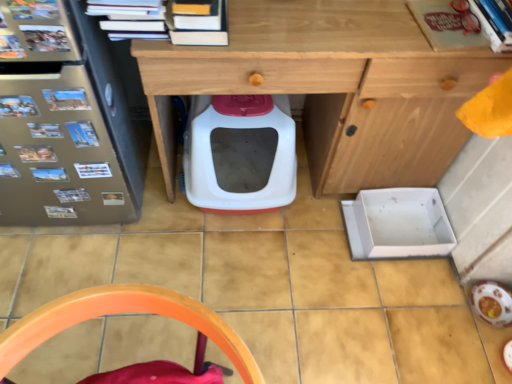
The width and height of the screenshot is (512, 384). Find the location of `orange plastic chair at lower center`. orange plastic chair at lower center is located at coordinates (131, 311).

Measure the distance between point (121, 34) and camera.

The distance of point (121, 34) from camera is 38.19 inches.

What do you see at coordinates (495, 22) in the screenshot?
I see `hardcover book at upper right, the 1th book viewed from the right` at bounding box center [495, 22].

What is the approximate width of matte red book at upper right, which appears as the 2th book when viewed from the left?

matte red book at upper right, which appears as the 2th book when viewed from the left, is 8.41 inches in width.

Where is `orange plastic chair at lower center`? orange plastic chair at lower center is located at coordinates (131, 311).

Is hardcover books at upper center, the 1th book positioned from the left, aimed at hardcover book at upper right, the 1th book viewed from the right?

No.

Between hardcover books at upper center, the third book when ordered from right to left, and hardcover book at upper right, the 1th book viewed from the right, which one has smaller size?

hardcover book at upper right, the 1th book viewed from the right.

Is hardcover books at upper center, the 1th book positioned from the left, not close to hardcover book at upper right, the 1th book viewed from the right?

That's not correct — hardcover books at upper center, the 1th book positioned from the left, is a little close to hardcover book at upper right, the 1th book viewed from the right.

Is hardcover books at upper center, the third book when ordered from right to left, facing away from metallic silver fridge at left?

No, metallic silver fridge at left is not at the back of hardcover books at upper center, the third book when ordered from right to left.

From the image's perspective, is hardcover books at upper center, the 1th book positioned from the left, located above or below metallic silver fridge at left?

Based on their image positions, hardcover books at upper center, the 1th book positioned from the left, is located above metallic silver fridge at left.

In the scene shown: Is hardcover books at upper center, the 1th book positioned from the left, outside of metallic silver fridge at left?

Yes, hardcover books at upper center, the 1th book positioned from the left, is not within metallic silver fridge at left.

Is hardcover books at upper center, the third book when ordered from right to left, smaller than metallic silver fridge at left?

Correct, hardcover books at upper center, the third book when ordered from right to left, occupies less space than metallic silver fridge at left.

From a real-world perspective, is hardcover book at upper right, which is the 3th book from left to right, physically below orange plastic chair at lower center?

No, from a real-world perspective, hardcover book at upper right, which is the 3th book from left to right, is not below orange plastic chair at lower center.

Based on their positions, is hardcover book at upper right, which is the 3th book from left to right, located to the left or right of orange plastic chair at lower center?

Based on their positions, hardcover book at upper right, which is the 3th book from left to right, is located to the right of orange plastic chair at lower center.

What's the angular difference between hardcover book at upper right, which is the 3th book from left to right, and orange plastic chair at lower center's facing directions?

They differ by 15.2 degrees in their facing directions.

Does hardcover book at upper right, the 1th book viewed from the right, touch orange plastic chair at lower center?

No, hardcover book at upper right, the 1th book viewed from the right, is not making contact with orange plastic chair at lower center.

Between hardcover book at upper right, the 1th book viewed from the right, and metallic silver fridge at left, which one appears on the left side from the viewer's perspective?

metallic silver fridge at left.

How distant is hardcover book at upper right, which is the 3th book from left to right, from metallic silver fridge at left?

hardcover book at upper right, which is the 3th book from left to right, is 3.74 feet away from metallic silver fridge at left.

Looking at this image, is hardcover book at upper right, which is the 3th book from left to right, bigger than metallic silver fridge at left?

No, hardcover book at upper right, which is the 3th book from left to right, is not bigger than metallic silver fridge at left.

Is hardcover book at upper right, which is the 3th book from left to right, shorter than metallic silver fridge at left?

Yes, hardcover book at upper right, which is the 3th book from left to right, is shorter than metallic silver fridge at left.

Identify the location of desk located on the right of orange plastic chair at lower center. This screenshot has width=512, height=384. (334, 86).

Considering the sizes of objects wooden desk at center and orange plastic chair at lower center in the image provided, who is bigger, wooden desk at center or orange plastic chair at lower center?

Bigger between the two is wooden desk at center.

Is point (362, 144) less distant than point (3, 345)?

No, it is not.

Does wooden desk at center have a greater width compared to orange plastic chair at lower center?

Indeed, wooden desk at center has a greater width compared to orange plastic chair at lower center.

Consider the image. How much distance is there between hardcover books at upper center, the third book when ordered from right to left, and orange plastic chair at lower center?

The distance of hardcover books at upper center, the third book when ordered from right to left, from orange plastic chair at lower center is 24.94 inches.

Is hardcover books at upper center, the 1th book positioned from the left, positioned with its back to orange plastic chair at lower center?

No, hardcover books at upper center, the 1th book positioned from the left,'s orientation is not away from orange plastic chair at lower center.

Which is in front, point (177, 3) or point (9, 357)?

The point (9, 357) is closer.

Can you confirm if hardcover books at upper center, the 1th book positioned from the left, is shorter than orange plastic chair at lower center?

Indeed, hardcover books at upper center, the 1th book positioned from the left, has a lesser height compared to orange plastic chair at lower center.

Could you tell me if metallic silver fridge at left is facing matte red book at upper right, which appears as the 2th book when viewed from the left?

No.

Which is in front, metallic silver fridge at left or matte red book at upper right, which appears as the 2th book when viewed from the left?

metallic silver fridge at left is in front.

Can you confirm if metallic silver fridge at left is taller than matte red book at upper right, which appears as the 2th book when viewed from the left?

Correct, metallic silver fridge at left is much taller as matte red book at upper right, which appears as the 2th book when viewed from the left.

Considering the positions of objects metallic silver fridge at left and matte red book at upper right, which is the 2th book from right to left, in the image provided, who is more to the left, metallic silver fridge at left or matte red book at upper right, which is the 2th book from right to left,?

metallic silver fridge at left is more to the left.

In the image, there is a hardcover book at upper right, which is the 3th book from left to right. At what (x,y) coordinates should I click in order to perform the action: click on book above it (from the image's perspective). Please return your answer as a coordinate pair (x, y). Looking at the image, I should click on (163, 20).

I want to click on fridge below the hardcover books at upper center, the third book when ordered from right to left (from the image's perspective), so click(68, 119).

Considering their positions, is wooden desk at center positioned closer to orange plastic chair at lower center than hardcover books at upper center, the 1th book positioned from the left?

hardcover books at upper center, the 1th book positioned from the left, lies closer to orange plastic chair at lower center than the other object.

Looking at the image, which one is located closer to orange plastic chair at lower center, wooden desk at center or white plastic litter box at center?

The object closer to orange plastic chair at lower center is wooden desk at center.

Looking at the image, which one is located further to wooden desk at center, orange plastic chair at lower center or hardcover books at upper center, the third book when ordered from right to left?

The object further to wooden desk at center is orange plastic chair at lower center.

Estimate the real-world distances between objects in this image. Which object is closer to metallic silver fridge at left, white plastic litter box at center or wooden desk at center?

white plastic litter box at center lies closer to metallic silver fridge at left than the other object.

Estimate the real-world distances between objects in this image. Which object is closer to matte red book at upper right, which appears as the 2th book when viewed from the left, orange plastic chair at lower center or white plastic litter box at center?

Among the two, white plastic litter box at center is located nearer to matte red book at upper right, which appears as the 2th book when viewed from the left.

Consider the image. Estimate the real-world distances between objects in this image. Which object is further from orange plastic chair at lower center, metallic silver fridge at left or matte red book at upper right, which appears as the 2th book when viewed from the left?

Based on the image, matte red book at upper right, which appears as the 2th book when viewed from the left, appears to be further to orange plastic chair at lower center.

Based on their spatial positions, is orange plastic chair at lower center or hardcover books at upper center, the 1th book positioned from the left, closer to white plastic litter box at center?

hardcover books at upper center, the 1th book positioned from the left, lies closer to white plastic litter box at center than the other object.

Based on their spatial positions, is orange plastic chair at lower center or matte red book at upper right, which appears as the 2th book when viewed from the left, closer to hardcover book at upper right, the 1th book viewed from the right?

matte red book at upper right, which appears as the 2th book when viewed from the left, lies closer to hardcover book at upper right, the 1th book viewed from the right, than the other object.

Where is `toilet located between hardcover books at upper center, the 1th book positioned from the left, and wooden desk at center in the left-right direction`? This screenshot has width=512, height=384. toilet located between hardcover books at upper center, the 1th book positioned from the left, and wooden desk at center in the left-right direction is located at coordinates (240, 153).

Image resolution: width=512 pixels, height=384 pixels. I want to click on desk located between white plastic litter box at center and hardcover book at upper right, the 1th book viewed from the right, in the left-right direction, so click(x=334, y=86).

Where is `book situated between wooden desk at center and hardcover book at upper right, the 1th book viewed from the right, from left to right`? The width and height of the screenshot is (512, 384). book situated between wooden desk at center and hardcover book at upper right, the 1th book viewed from the right, from left to right is located at coordinates (451, 24).

Where is `book between hardcover books at upper center, the third book when ordered from right to left, and hardcover book at upper right, which is the 3th book from left to right`? The width and height of the screenshot is (512, 384). book between hardcover books at upper center, the third book when ordered from right to left, and hardcover book at upper right, which is the 3th book from left to right is located at coordinates (451, 24).